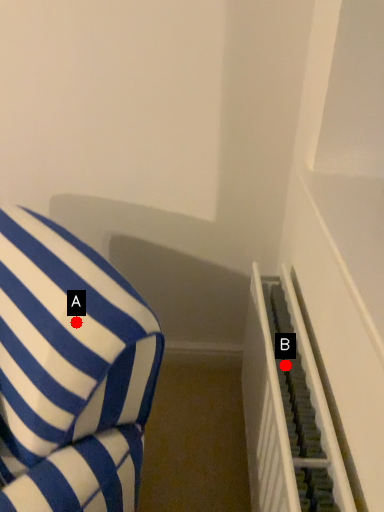
Question: Two points are circled on the image, labeled by A and B beside each circle. Which point is closer to the camera?

Choices:
 (A) A is closer
 (B) B is closer

Answer: (A)